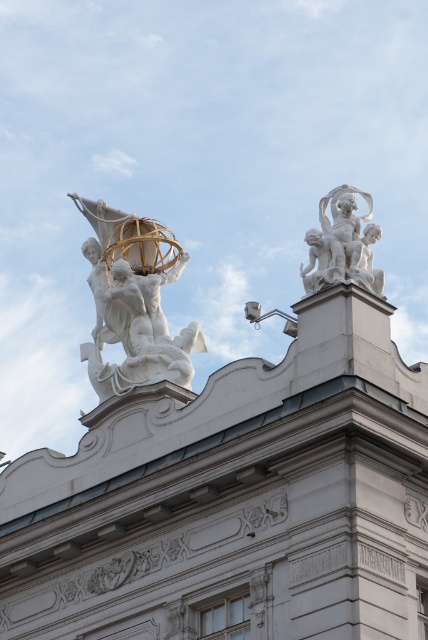
Question: Can you confirm if white marble statue at upper left is smaller than white marble cherubs at upper right?

Choices:
 (A) yes
 (B) no

Answer: (A)

Question: Which point appears farthest from the camera in this image?

Choices:
 (A) (336, 193)
 (B) (190, 349)

Answer: (B)

Question: Does white marble statue at upper left have a larger size compared to white marble cherubs at upper right?

Choices:
 (A) no
 (B) yes

Answer: (A)

Question: Considering the relative positions of white marble statue at upper left and white marble cherubs at upper right in the image provided, where is white marble statue at upper left located with respect to white marble cherubs at upper right?

Choices:
 (A) right
 (B) left

Answer: (B)

Question: Which point is farther to the camera?

Choices:
 (A) [x=152, y=240]
 (B) [x=329, y=193]

Answer: (B)